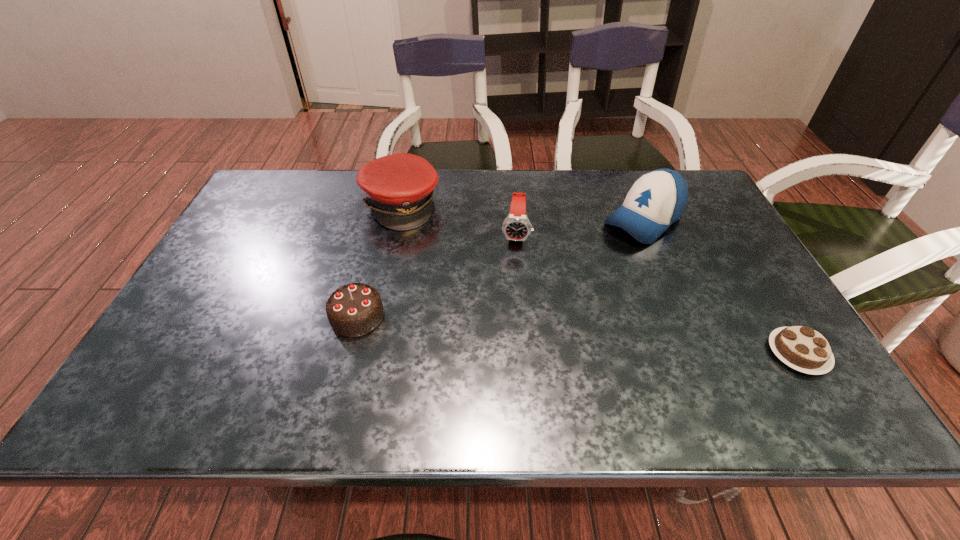
At what (x,y) coordinates should I click in order to perform the action: click on vacant space on the desktop that is between the left chocolate cake and the shortest object and is positioned on the face of the watch. Please return your answer as a coordinate pair (x, y). The image size is (960, 540). Looking at the image, I should click on (508, 329).

The height and width of the screenshot is (540, 960). What are the coordinates of `free space on the desktop that is between the taller chocolate cake and the shorter chocolate cake and is positioned on the front of the cap with an emblem` in the screenshot? It's located at pos(531,331).

This screenshot has height=540, width=960. Identify the location of free spot on the desktop that is between the left chocolate cake and the shorter chocolate cake and is positioned on the front-facing side of the second object from right to left. (506, 329).